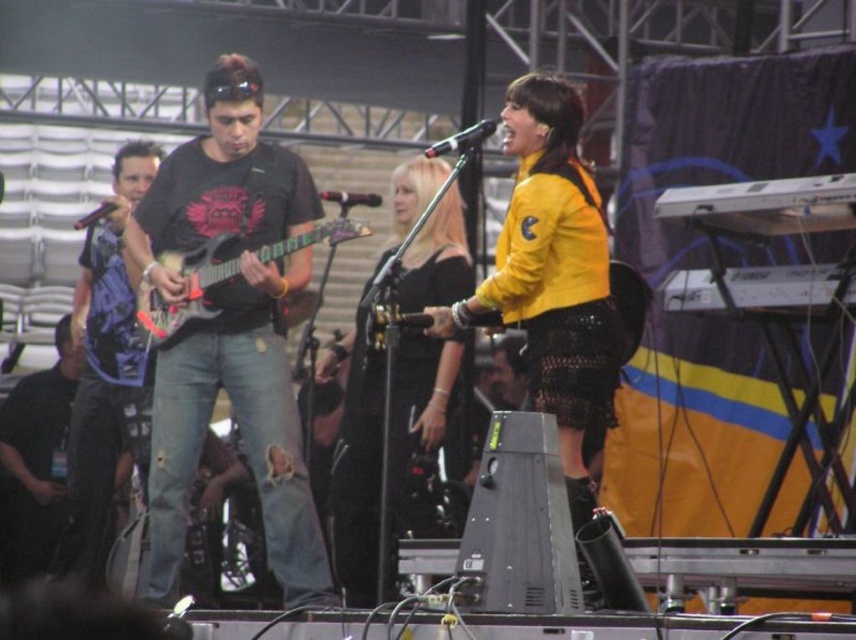
Does black matte shirt at lower left have a greater height compared to black metallic microphone at upper center?

Yes, black matte shirt at lower left is taller than black metallic microphone at upper center.

Is point (27, 444) closer to camera compared to point (480, 124)?

No.

Who is more distant from viewer, (37,520) or (455,141)?

The point (37,520) is more distant.

The width and height of the screenshot is (856, 640). Find the location of `black matte shirt at lower left`. black matte shirt at lower left is located at coordinates (34, 461).

Between yellow matte jacket at center and black matte shirt at lower left, which one has more height?

With more height is yellow matte jacket at center.

Is point (485, 323) closer to viewer compared to point (34, 556)?

Yes.

Find the location of a particular element. yellow matte jacket at center is located at coordinates (551, 275).

Is brushed metal guitar at left to the left of metallic electric guitar at center-left from the viewer's perspective?

Result: Yes, brushed metal guitar at left is to the left of metallic electric guitar at center-left.

Does brushed metal guitar at left have a greater width compared to metallic electric guitar at center-left?

No.

Where is `brushed metal guitar at left`? This screenshot has width=856, height=640. brushed metal guitar at left is located at coordinates (107, 372).